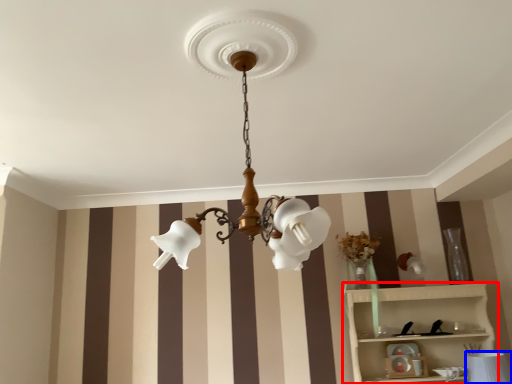
Question: Which object appears farthest to the camera in this image, shelf (highlighted by a red box) or table lamp (highlighted by a blue box)?

Choices:
 (A) shelf
 (B) table lamp

Answer: (A)